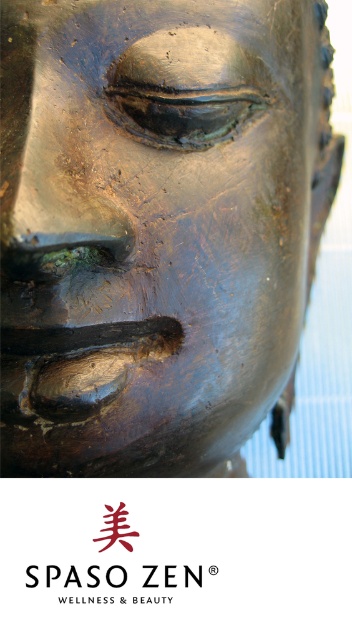
Question: Which object is closer to the camera taking this photo?

Choices:
 (A) black matte text at center
 (B) bronze sculpture at center

Answer: (B)

Question: In this image, where is bronze sculpture at center located relative to black matte text at center?

Choices:
 (A) above
 (B) below

Answer: (A)

Question: Which object is closer to the camera taking this photo?

Choices:
 (A) bronze sculpture at center
 (B) black matte text at center

Answer: (A)

Question: Which object appears farthest from the camera in this image?

Choices:
 (A) black matte text at center
 (B) bronze sculpture at center

Answer: (A)

Question: Can you confirm if bronze sculpture at center is positioned to the left of black matte text at center?

Choices:
 (A) no
 (B) yes

Answer: (A)

Question: Does bronze sculpture at center appear under black matte text at center?

Choices:
 (A) yes
 (B) no

Answer: (B)